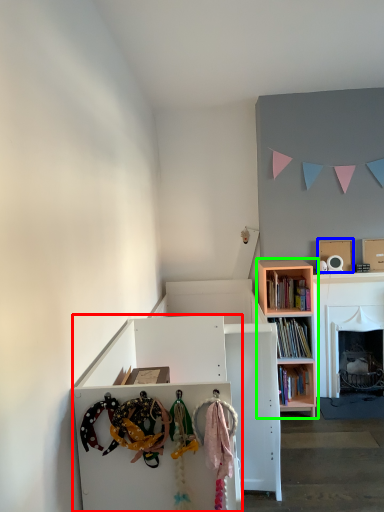
Question: Which object is the farthest from cabinetry (highlighted by a red box)? Choose among these: cardboard box (highlighted by a blue box) or bookcase (highlighted by a green box).

Choices:
 (A) cardboard box
 (B) bookcase

Answer: (A)